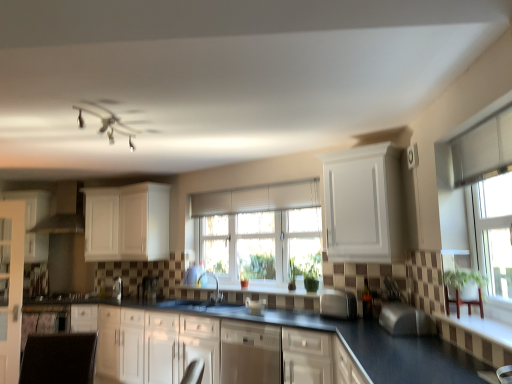
Question: Does point (331, 296) appear closer or farther from the camera than point (57, 208)?

Choices:
 (A) farther
 (B) closer

Answer: (B)

Question: From the image's perspective, relative to matte white exhaust hood at left, is silver metallic toaster at center, the 2th appliance in the back-to-front sequence, above or below?

Choices:
 (A) above
 (B) below

Answer: (B)

Question: Estimate the real-world distances between objects in this image. Which object is farther from the white glossy cabinets at center, the 4th cabinetry when ordered from left to right?

Choices:
 (A) satin silver toaster at center, which is counted as the first appliance, starting from the left
 (B) white matte cabinet at upper center, the 5th cabinetry viewed from the left
 (C) white matte cabinet at center, the 3th cabinetry from the right
 (D) clear glass door at left
 (E) white matte cabinet at upper left, arranged as the 2th cabinetry when viewed from the left

Answer: (A)

Question: Estimate the real-world distances between objects in this image. Which object is farther from the white glass window at center, marked as the first window in a back-to-front arrangement?

Choices:
 (A) white fabric armchair at lower right
 (B) satin nickel faucet at center
 (C) silver metallic toaster at center, the 2th appliance in the back-to-front sequence
 (D) matte white exhaust hood at left
 (E) white matte cabinet at upper left, marked as the 4th cabinetry in a right-to-left arrangement

Answer: (A)